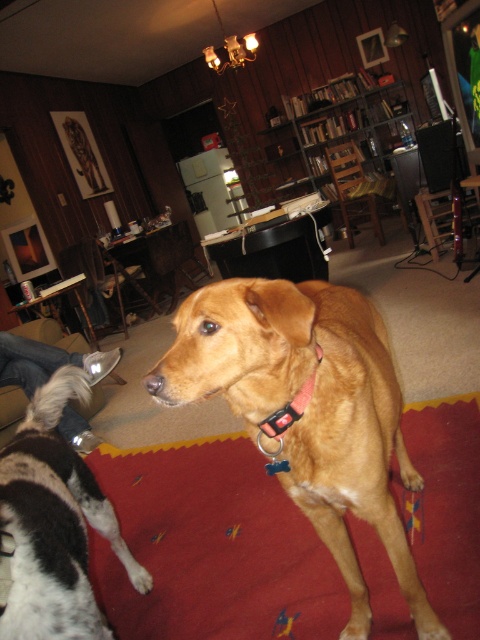
Between point (88, 595) and point (96, 371), which one is positioned behind?

Point (96, 371)

Does point (132, 564) come behind point (76, 358)?

That is False.

Find the location of a particular element. The width and height of the screenshot is (480, 640). brown fur dog at center is located at coordinates (54, 524).

The width and height of the screenshot is (480, 640). Identify the location of brown fur dog at center. (54, 524).

Consider the image. Is golden fur dog at center to the left of red fabric collar at center from the viewer's perspective?

In fact, golden fur dog at center is to the right of red fabric collar at center.

In the scene shown: Can you confirm if golden fur dog at center is thinner than red fabric collar at center?

Incorrect, golden fur dog at center's width is not less than red fabric collar at center's.

Which is behind, point (354, 637) or point (298, 406)?

The point (354, 637) is more distant.

Image resolution: width=480 pixels, height=640 pixels. Identify the location of golden fur dog at center. (308, 410).

Which is above, golden fur dog at center or white fur at lower left?

golden fur dog at center is higher up.

Image resolution: width=480 pixels, height=640 pixels. Find the location of `golden fur dog at center`. golden fur dog at center is located at coordinates (308, 410).